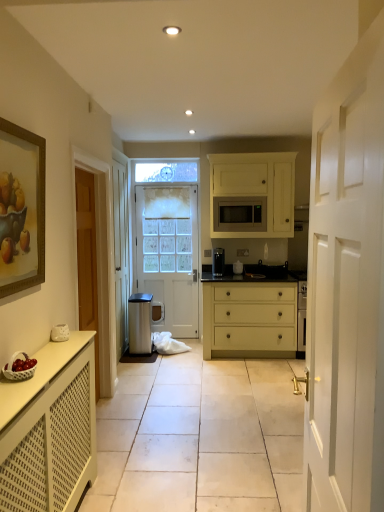
Image resolution: width=384 pixels, height=512 pixels. Find the location of `blank space situated above white glossy radiator at lower left (from a real-world perspective)`. blank space situated above white glossy radiator at lower left (from a real-world perspective) is located at coordinates (205, 382).